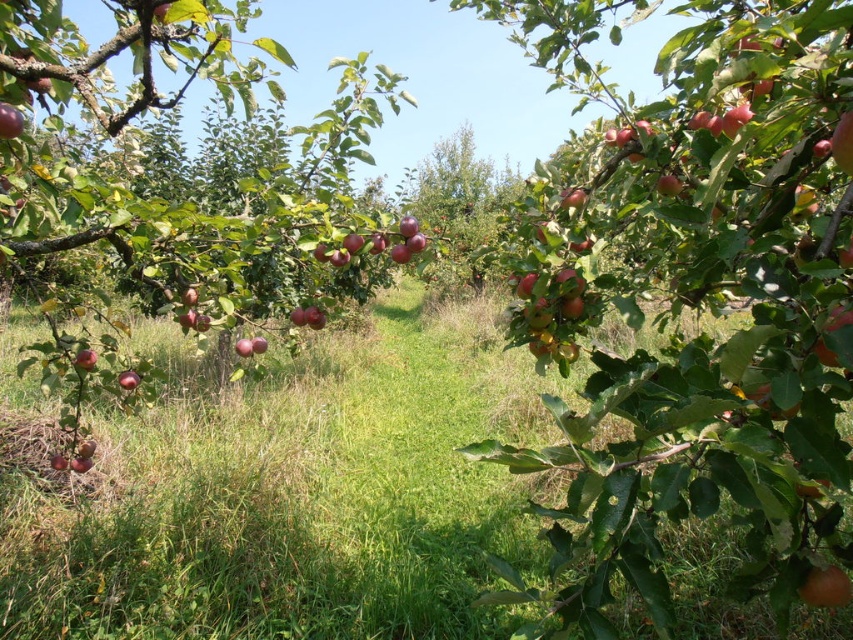
Who is more distant from viewer, (263, 448) or (117, 380)?

The point (263, 448) is behind.

Does green grass at center appear over glossy red apple at center?

Incorrect, green grass at center is not positioned above glossy red apple at center.

The height and width of the screenshot is (640, 853). What do you see at coordinates (296, 497) in the screenshot? I see `green grass at center` at bounding box center [296, 497].

Locate an element on the screen. The width and height of the screenshot is (853, 640). green grass at center is located at coordinates (296, 497).

Who is more forward, (93, 353) or (135, 380)?

Positioned in front is point (93, 353).

Does shiny red apple at lower left have a lesser width compared to glossy red apple at center?

Yes, shiny red apple at lower left is thinner than glossy red apple at center.

Does point (83, 356) come farther from viewer compared to point (126, 388)?

That is False.

Identify the location of shiny red apple at lower left. The width and height of the screenshot is (853, 640). [x=85, y=358].

Is shiny red apple at center to the right of glossy red apple at center from the viewer's perspective?

Correct, you'll find shiny red apple at center to the right of glossy red apple at center.

Can you confirm if shiny red apple at center is positioned above glossy red apple at center?

Actually, shiny red apple at center is below glossy red apple at center.

Does point (816, 605) come closer to viewer compared to point (125, 378)?

Yes, it is in front of point (125, 378).

You are a GUI agent. You are given a task and a screenshot of the screen. Output one action in this format:
    pyautogui.click(x=<x>, y=<y>)
    Task: Click on the shiny red apple at center
    
    Given the screenshot: What is the action you would take?
    pyautogui.click(x=825, y=588)